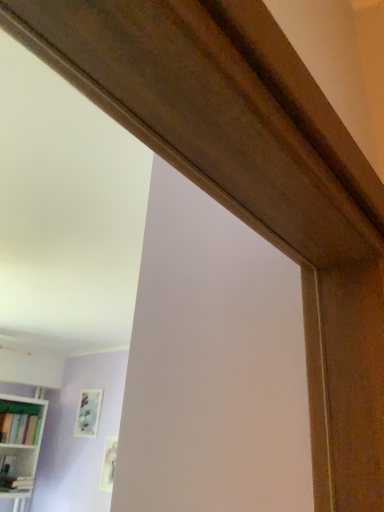
How much space does matte white picture frame at lower center, the 1th picture frame in the right-to-left sequence, occupy horizontally?

0.58 inches.

Locate an element on the screen. The width and height of the screenshot is (384, 512). matte green bookshelf at lower left is located at coordinates (19, 428).

Find the location of a particular element. The height and width of the screenshot is (512, 384). matte white picture frame at lower center, which ranks as the first picture frame in front-to-back order is located at coordinates (109, 463).

Is white glossy bookcase at lower left beside matte wooden picture frame at upper left, the second picture frame in the front-to-back sequence?

No, white glossy bookcase at lower left is not in contact with matte wooden picture frame at upper left, the second picture frame in the front-to-back sequence.

In terms of height, does white glossy bookcase at lower left look taller or shorter compared to matte wooden picture frame at upper left, the 1th picture frame viewed from the left?

A: Considering their sizes, white glossy bookcase at lower left has more height than matte wooden picture frame at upper left, the 1th picture frame viewed from the left.

Could you tell me if white glossy bookcase at lower left is turned towards matte wooden picture frame at upper left, acting as the 2th picture frame starting from the right?

No.

In the image, is white glossy bookcase at lower left on the left side or the right side of matte wooden picture frame at upper left, acting as the first picture frame starting from the back?

Based on their positions, white glossy bookcase at lower left is located to the left of matte wooden picture frame at upper left, acting as the first picture frame starting from the back.

How different are the orientations of matte white picture frame at lower center, which is the second picture frame from back to front, and matte green bookshelf at lower left in degrees?

90 degrees separate the facing orientations of matte white picture frame at lower center, which is the second picture frame from back to front, and matte green bookshelf at lower left.

Is point (110, 478) more distant than point (32, 417)?

No, (110, 478) is closer to viewer.

From a real-world perspective, is matte white picture frame at lower center, the second picture frame in the left-to-right sequence, under matte green bookshelf at lower left?

Yes, from a real-world perspective, matte white picture frame at lower center, the second picture frame in the left-to-right sequence, is below matte green bookshelf at lower left.

Considering the relative sizes of matte white picture frame at lower center, which is the second picture frame from back to front, and matte green bookshelf at lower left in the image provided, is matte white picture frame at lower center, which is the second picture frame from back to front, taller than matte green bookshelf at lower left?

Yes, matte white picture frame at lower center, which is the second picture frame from back to front, is taller than matte green bookshelf at lower left.

Is there a large distance between matte wooden picture frame at upper left, acting as the first picture frame starting from the back, and white glossy bookcase at lower left?

No.

Is matte wooden picture frame at upper left, the 1th picture frame viewed from the left, aimed at white glossy bookcase at lower left?

No, matte wooden picture frame at upper left, the 1th picture frame viewed from the left, does not turn towards white glossy bookcase at lower left.

Considering the sizes of objects matte wooden picture frame at upper left, the second picture frame in the front-to-back sequence, and white glossy bookcase at lower left in the image provided, who is thinner, matte wooden picture frame at upper left, the second picture frame in the front-to-back sequence, or white glossy bookcase at lower left?

matte wooden picture frame at upper left, the second picture frame in the front-to-back sequence, is thinner.

Is matte wooden picture frame at upper left, acting as the first picture frame starting from the back, positioned beyond the bounds of white glossy bookcase at lower left?

Yes, matte wooden picture frame at upper left, acting as the first picture frame starting from the back, is located beyond the bounds of white glossy bookcase at lower left.

Is white glossy bookcase at lower left oriented away from matte white picture frame at lower center, which ranks as the first picture frame in front-to-back order?

That's not correct — white glossy bookcase at lower left is not looking away from matte white picture frame at lower center, which ranks as the first picture frame in front-to-back order.

Consider the image. Looking at the image, does white glossy bookcase at lower left seem bigger or smaller compared to matte white picture frame at lower center, which ranks as the first picture frame in front-to-back order?

white glossy bookcase at lower left is bigger than matte white picture frame at lower center, which ranks as the first picture frame in front-to-back order.

Does white glossy bookcase at lower left have a greater height compared to matte white picture frame at lower center, the 1th picture frame in the right-to-left sequence?

Yes.

Is white glossy bookcase at lower left next to matte white picture frame at lower center, which ranks as the first picture frame in front-to-back order?

No, white glossy bookcase at lower left is not beside matte white picture frame at lower center, which ranks as the first picture frame in front-to-back order.

Does point (111, 464) appear closer or farther from the camera than point (86, 396)?

Point (111, 464) is positioned closer to the camera compared to point (86, 396).

Is matte wooden picture frame at upper left, acting as the first picture frame starting from the back, completely or partially inside matte white picture frame at lower center, the second picture frame in the left-to-right sequence?

No, matte white picture frame at lower center, the second picture frame in the left-to-right sequence, does not contain matte wooden picture frame at upper left, acting as the first picture frame starting from the back.

Who is shorter, matte white picture frame at lower center, which ranks as the first picture frame in front-to-back order, or matte wooden picture frame at upper left, acting as the first picture frame starting from the back?

matte wooden picture frame at upper left, acting as the first picture frame starting from the back, is shorter.

From a real-world perspective, who is located lower, matte white picture frame at lower center, the second picture frame in the left-to-right sequence, or matte wooden picture frame at upper left, acting as the 2th picture frame starting from the right?

matte white picture frame at lower center, the second picture frame in the left-to-right sequence, is physically lower.

Considering the sizes of objects matte wooden picture frame at upper left, the second picture frame in the front-to-back sequence, and matte green bookshelf at lower left in the image provided, who is wider, matte wooden picture frame at upper left, the second picture frame in the front-to-back sequence, or matte green bookshelf at lower left?

Wider between the two is matte green bookshelf at lower left.

From a real-world perspective, is matte wooden picture frame at upper left, acting as the first picture frame starting from the back, below matte green bookshelf at lower left?

No, from a real-world perspective, matte wooden picture frame at upper left, acting as the first picture frame starting from the back, is not beneath matte green bookshelf at lower left.

Which point is more forward, (81, 431) or (27, 431)?

Positioned in front is point (27, 431).

Is matte wooden picture frame at upper left, acting as the 2th picture frame starting from the right, not close to matte green bookshelf at lower left?

No, matte wooden picture frame at upper left, acting as the 2th picture frame starting from the right, is not far away from matte green bookshelf at lower left.

Is matte green bookshelf at lower left beside white glossy bookcase at lower left?

Yes, matte green bookshelf at lower left is right next to white glossy bookcase at lower left and making contact.

Based on the photo, from a real-world perspective, who is located higher, matte green bookshelf at lower left or white glossy bookcase at lower left?

matte green bookshelf at lower left is physically above.

How different are the orientations of matte green bookshelf at lower left and white glossy bookcase at lower left in degrees?

The angular difference between matte green bookshelf at lower left and white glossy bookcase at lower left is 0.00131 degrees.

From the image's perspective, which is below, matte green bookshelf at lower left or white glossy bookcase at lower left?

From the image's view, white glossy bookcase at lower left is below.

The width and height of the screenshot is (384, 512). I want to click on bookcase on the left of matte wooden picture frame at upper left, the 1th picture frame viewed from the left, so click(x=20, y=446).

Where is `book behind the matte white picture frame at lower center, which ranks as the first picture frame in front-to-back order`? The height and width of the screenshot is (512, 384). book behind the matte white picture frame at lower center, which ranks as the first picture frame in front-to-back order is located at coordinates (19, 428).

Consider the image. From the image, which object appears to be nearer to matte white picture frame at lower center, the 1th picture frame in the right-to-left sequence, matte green bookshelf at lower left or matte wooden picture frame at upper left, acting as the 2th picture frame starting from the right?

matte wooden picture frame at upper left, acting as the 2th picture frame starting from the right, is closer to matte white picture frame at lower center, the 1th picture frame in the right-to-left sequence.

Estimate the real-world distances between objects in this image. Which object is further from white glossy bookcase at lower left, matte wooden picture frame at upper left, acting as the first picture frame starting from the back, or matte green bookshelf at lower left?

Among the two, matte wooden picture frame at upper left, acting as the first picture frame starting from the back, is located further to white glossy bookcase at lower left.

Looking at this image, estimate the real-world distances between objects in this image. Which object is closer to matte wooden picture frame at upper left, the second picture frame in the front-to-back sequence, white glossy bookcase at lower left or matte white picture frame at lower center, which is the second picture frame from back to front?

matte white picture frame at lower center, which is the second picture frame from back to front.

Based on their spatial positions, is white glossy bookcase at lower left or matte white picture frame at lower center, which ranks as the first picture frame in front-to-back order, closer to matte green bookshelf at lower left?

white glossy bookcase at lower left lies closer to matte green bookshelf at lower left than the other object.

From the image, which object appears to be nearer to matte white picture frame at lower center, the 1th picture frame in the right-to-left sequence, matte wooden picture frame at upper left, the second picture frame in the front-to-back sequence, or white glossy bookcase at lower left?

Among the two, matte wooden picture frame at upper left, the second picture frame in the front-to-back sequence, is located nearer to matte white picture frame at lower center, the 1th picture frame in the right-to-left sequence.

Looking at the image, which one is located closer to matte green bookshelf at lower left, matte wooden picture frame at upper left, the second picture frame in the front-to-back sequence, or matte white picture frame at lower center, which ranks as the first picture frame in front-to-back order?

matte wooden picture frame at upper left, the second picture frame in the front-to-back sequence, lies closer to matte green bookshelf at lower left than the other object.

Considering their positions, is white glossy bookcase at lower left positioned further to matte white picture frame at lower center, which is the second picture frame from back to front, than matte wooden picture frame at upper left, acting as the first picture frame starting from the back?

The object further to matte white picture frame at lower center, which is the second picture frame from back to front, is white glossy bookcase at lower left.

Which object lies nearer to the anchor point matte wooden picture frame at upper left, acting as the first picture frame starting from the back, matte white picture frame at lower center, which ranks as the first picture frame in front-to-back order, or white glossy bookcase at lower left?

matte white picture frame at lower center, which ranks as the first picture frame in front-to-back order, is positioned closer to the anchor matte wooden picture frame at upper left, acting as the first picture frame starting from the back.

You are a GUI agent. You are given a task and a screenshot of the screen. Output one action in this format:
    pyautogui.click(x=<x>, y=<y>)
    Task: Click on the picture frame situated between white glossy bookcase at lower left and matte white picture frame at lower center, the second picture frame in the left-to-right sequence, from left to right
    Image resolution: width=384 pixels, height=512 pixels.
    Given the screenshot: What is the action you would take?
    (x=88, y=413)

Locate an element on the screen. picture frame between matte green bookshelf at lower left and matte white picture frame at lower center, which is the second picture frame from back to front, in the horizontal direction is located at coordinates (88, 413).

Where is `book between white glossy bookcase at lower left and matte wooden picture frame at upper left, the 1th picture frame viewed from the left, from left to right`? The width and height of the screenshot is (384, 512). book between white glossy bookcase at lower left and matte wooden picture frame at upper left, the 1th picture frame viewed from the left, from left to right is located at coordinates (19, 428).

Locate an element on the screen. This screenshot has width=384, height=512. book located between white glossy bookcase at lower left and matte white picture frame at lower center, the second picture frame in the left-to-right sequence, in the left-right direction is located at coordinates (19, 428).